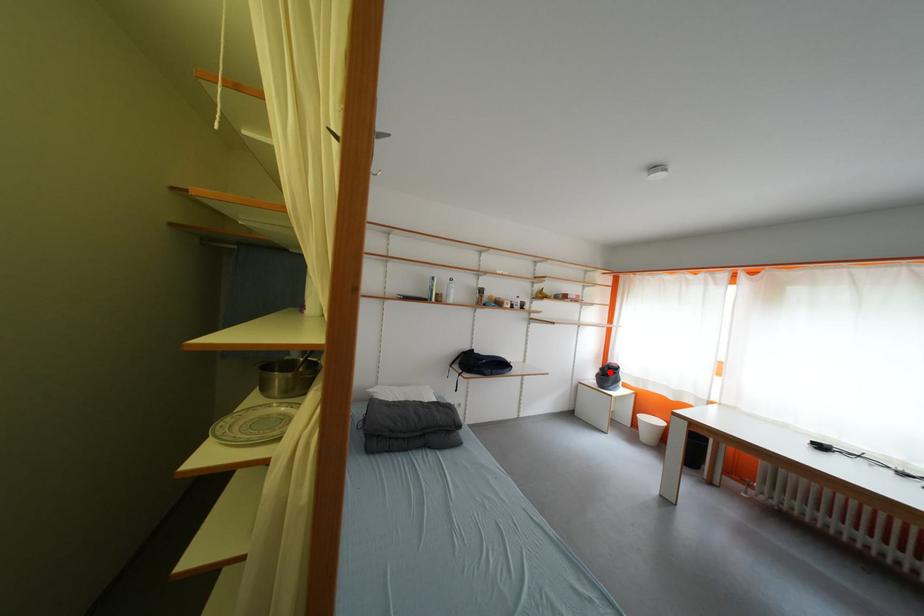
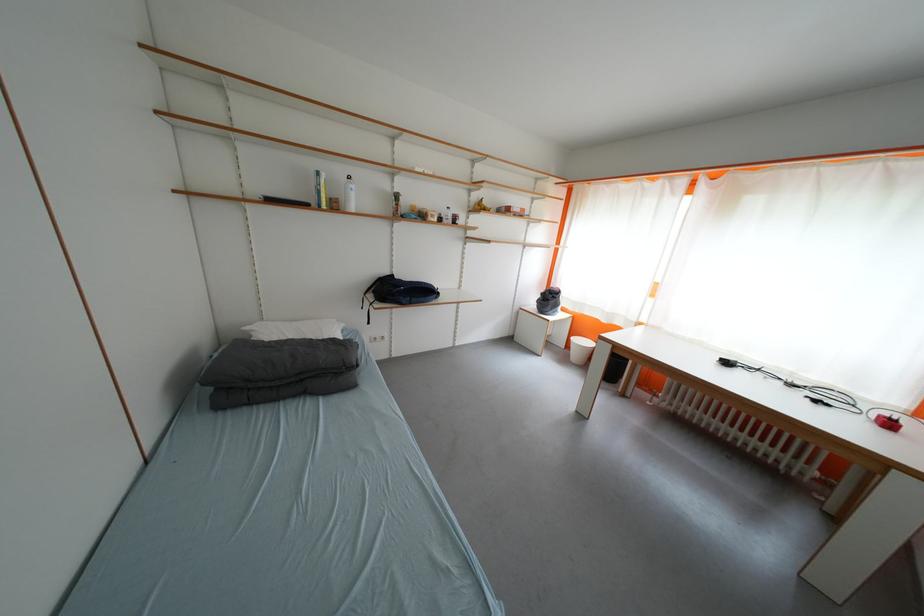
The point at the highlighted location is marked in the first image. Where is the corresponding point in the second image?

(551, 297)